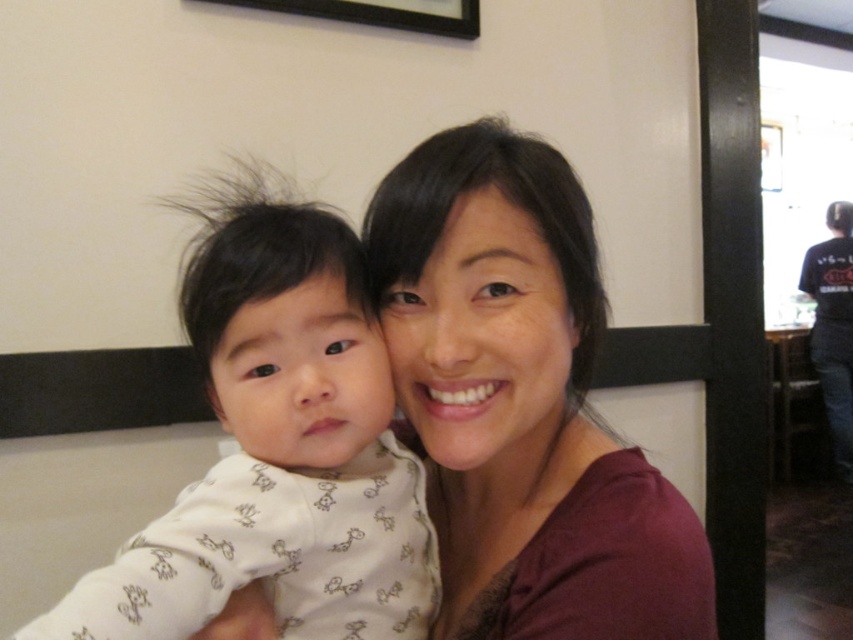
Measure the distance between matte maroon shirt at center and black t-shirt at right.

13.31 feet

Consider the image. Can you confirm if matte maroon shirt at center is positioned above black t-shirt at right?

Indeed, matte maroon shirt at center is positioned over black t-shirt at right.

Locate an element on the screen. The image size is (853, 640). matte maroon shirt at center is located at coordinates (521, 403).

Can you confirm if white soft fabric baby at left is bigger than black t-shirt at right?

No.

Can you confirm if white soft fabric baby at left is positioned to the right of black t-shirt at right?

Incorrect, white soft fabric baby at left is not on the right side of black t-shirt at right.

Does point (257, 371) lie in front of point (851, 280)?

Yes, point (257, 371) is closer to viewer.

This screenshot has height=640, width=853. I want to click on white soft fabric baby at left, so click(277, 451).

Measure the distance between black t-shirt at right and black matte picture frame at upper center.

3.40 meters

Between black t-shirt at right and black matte picture frame at upper center, which one is positioned lower?

black t-shirt at right

Does point (846, 204) lie in front of point (314, 1)?

No.

Find the location of `black t-shirt at right`. black t-shirt at right is located at coordinates (833, 326).